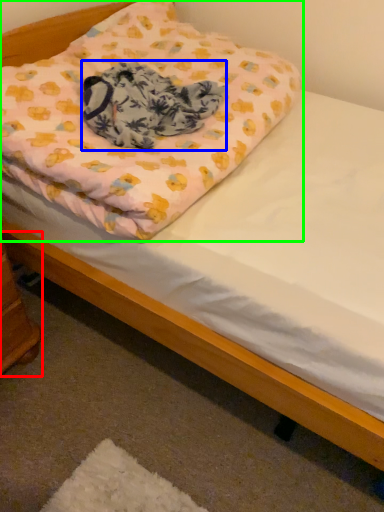
Question: Based on their relative distances, which object is farther from changing table (highlighted by a red box)? Choose from blanket (highlighted by a blue box) and pillow (highlighted by a green box).

Choices:
 (A) blanket
 (B) pillow

Answer: (B)